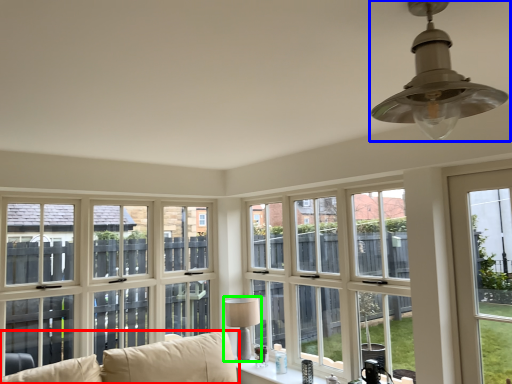
Question: Based on their relative distances, which object is farther from studio couch (highlighted by a red box)? Choose from lamp (highlighted by a blue box) and lamp (highlighted by a green box).

Choices:
 (A) lamp
 (B) lamp

Answer: (A)